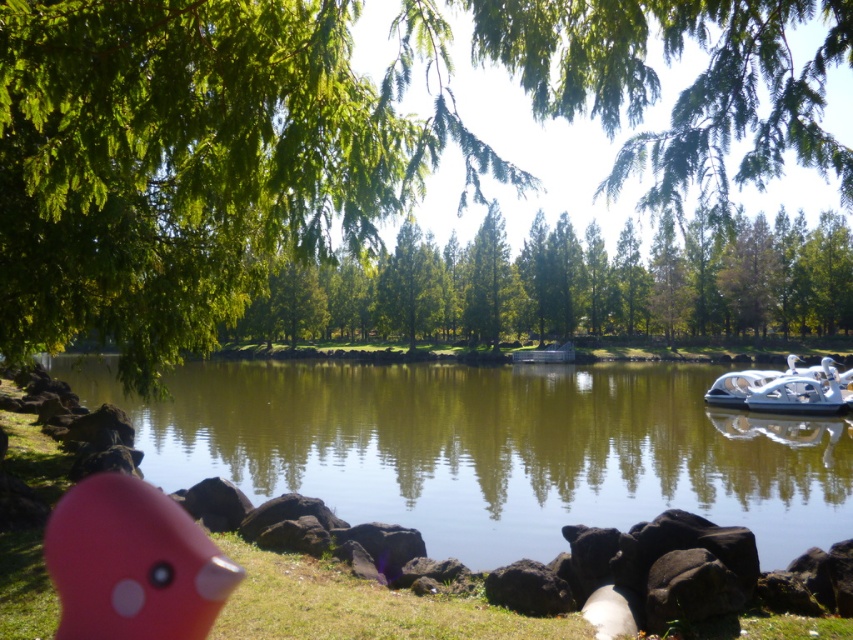
Question: Which point is farther from the camera taking this photo?

Choices:
 (A) (178, 560)
 (B) (206, 243)

Answer: (B)

Question: Can you confirm if green leafy tree at upper center is positioned to the right of white plastic boat at right?

Choices:
 (A) no
 (B) yes

Answer: (A)

Question: Which point appears closest to the camera in this image?

Choices:
 (A) (733, 406)
 (B) (387, 273)
 (C) (80, 618)
 (D) (711, 115)

Answer: (D)

Question: Which point is closer to the camera taking this photo?

Choices:
 (A) (91, 324)
 (B) (601, 266)

Answer: (A)

Question: From the image, what is the correct spatial relationship of green leafy tree at upper center in relation to green leafy tree at center?

Choices:
 (A) right
 (B) left

Answer: (A)

Question: Is pink rubber duck at lower left above white plastic boat at right?

Choices:
 (A) no
 (B) yes

Answer: (A)